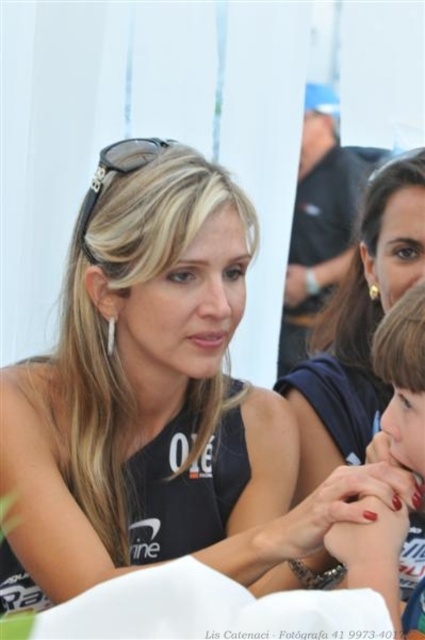
What are the coordinates of the matte black tank top at center?

The matte black tank top at center is located at point (158, 403).

You are a photographer trying to capture a closeup shot of the matte black tank top at center while ensuring the blonde hair at center is still visible in the frame. Given the distance between them, can you fit both in the camera frame if your lens has a 50cm field of view?

The matte black tank top at center and blonde hair at center are 36.43 centimeters apart. Since the distance between them is less than the 50cm field of view of the lens, both can be captured within the frame while maintaining visibility.

In the scene shown: You are a photographer adjusting the camera settings to focus on the matte black tank top at center and the blonde hair at center. Which object should you adjust the focus to first if you want to capture the wider object first?

The matte black tank top at center should be focused on first because its width surpasses that of the blonde hair at center, making it the wider object.